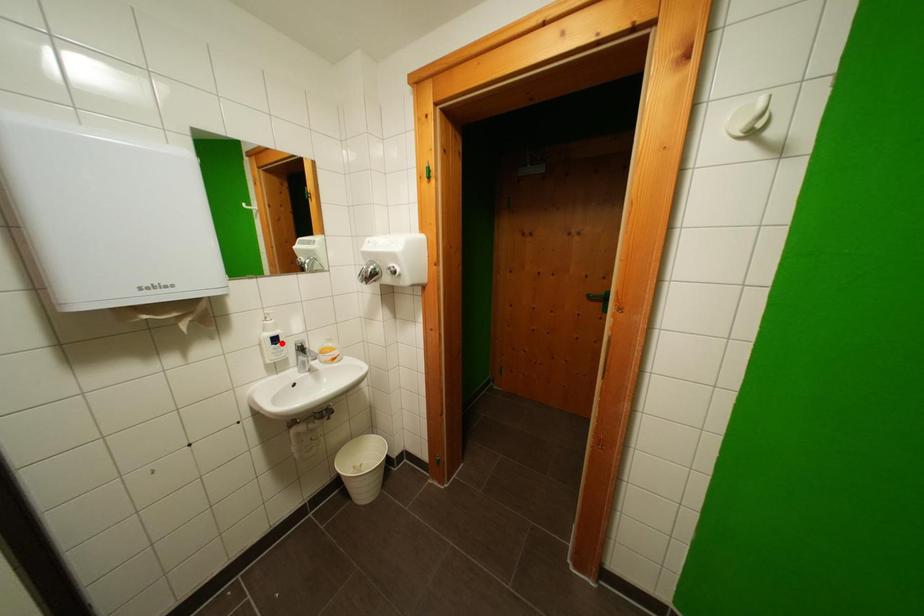
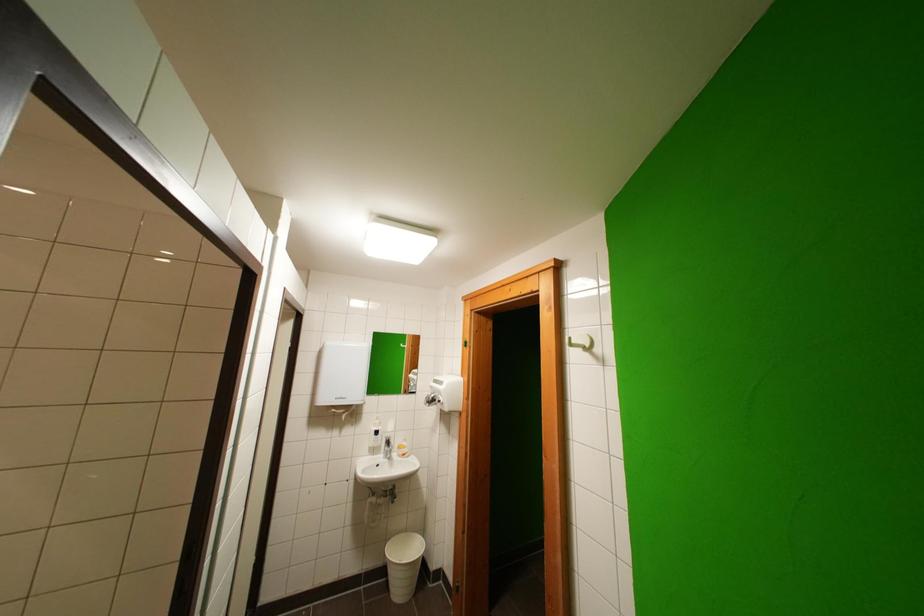
Find the pixel in the second image that matches the highlighted location in the first image.

(383, 436)